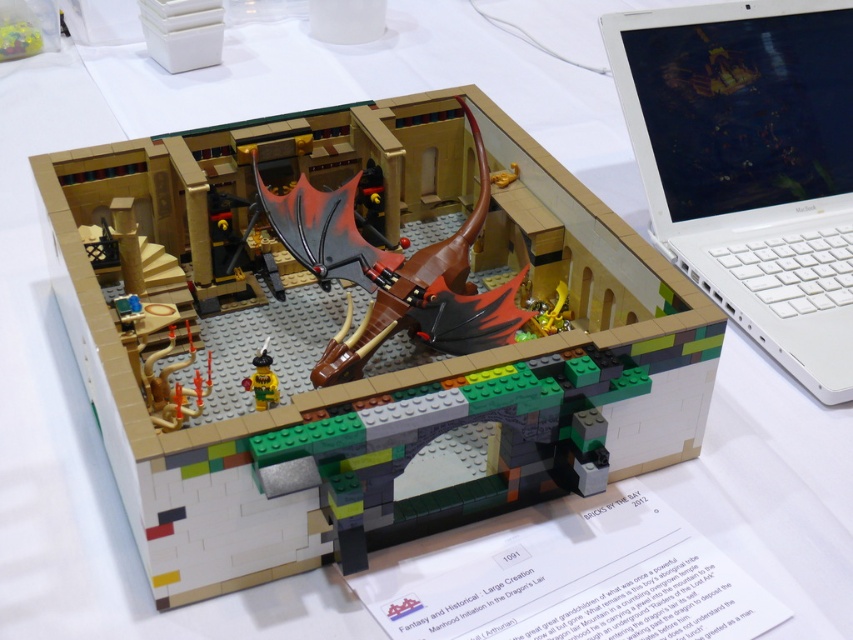
Question: Is white plastic laptop at upper right bigger than shiny metallic dragon at center?

Choices:
 (A) no
 (B) yes

Answer: (B)

Question: Is shiny metallic dragon at center wider than bright yellow plastic minifigure at center?

Choices:
 (A) yes
 (B) no

Answer: (A)

Question: Which point is farther from the camera taking this photo?

Choices:
 (A) (665, 154)
 (B) (490, 333)
 (C) (260, 400)

Answer: (A)

Question: Which point is farther from the camera taking this photo?

Choices:
 (A) (274, 384)
 (B) (482, 301)

Answer: (B)

Question: Estimate the real-world distances between objects in this image. Which object is farther from the shiny metallic dragon at center?

Choices:
 (A) bright yellow plastic minifigure at center
 (B) white plastic laptop at upper right

Answer: (B)

Question: Is shiny metallic dragon at center to the left of bright yellow plastic minifigure at center from the viewer's perspective?

Choices:
 (A) no
 (B) yes

Answer: (A)